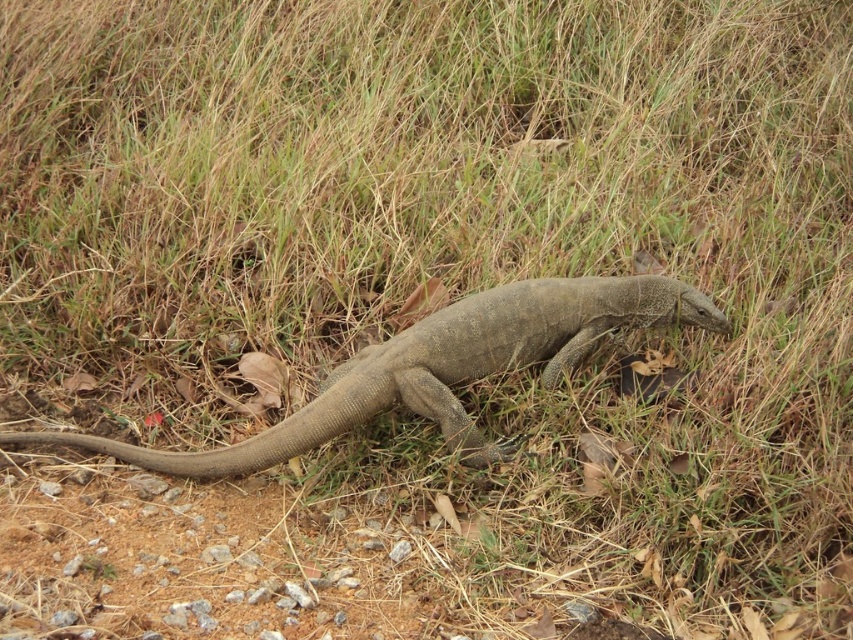
Question: Is gray textured lizard at center smaller than brown rough tail at lower left?

Choices:
 (A) no
 (B) yes

Answer: (A)

Question: Can you confirm if gray textured lizard at center is bigger than brown rough tail at lower left?

Choices:
 (A) no
 (B) yes

Answer: (B)

Question: Can you confirm if gray textured lizard at center is thinner than brown rough tail at lower left?

Choices:
 (A) yes
 (B) no

Answer: (B)

Question: Which object appears closest to the camera in this image?

Choices:
 (A) gray textured lizard at center
 (B) brown rough tail at lower left

Answer: (B)

Question: Which object is closer to the camera taking this photo?

Choices:
 (A) brown rough tail at lower left
 (B) gray textured lizard at center

Answer: (A)

Question: Among these points, which one is nearest to the camera?

Choices:
 (A) (323, 400)
 (B) (471, 362)

Answer: (A)